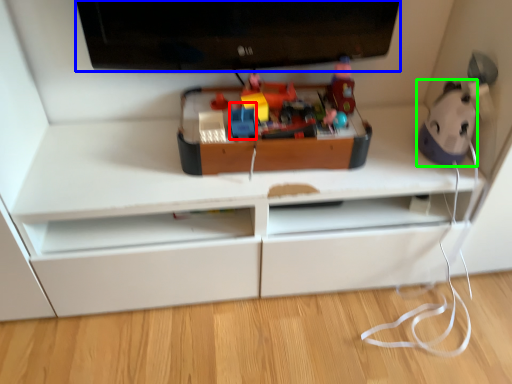
Question: Based on their relative distances, which object is farther from toy (highlighted by a red box)? Choose from television (highlighted by a blue box) and toy (highlighted by a green box).

Choices:
 (A) television
 (B) toy

Answer: (B)